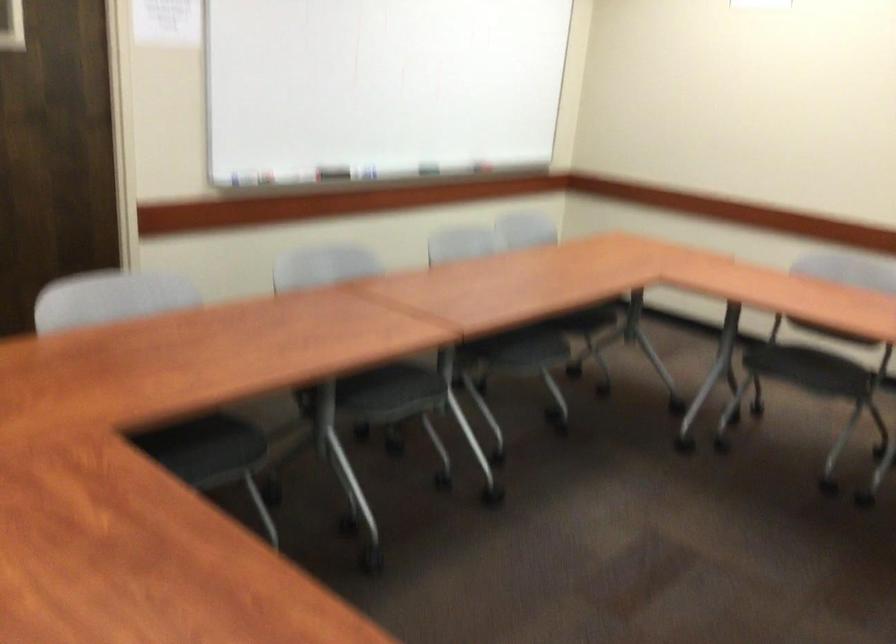
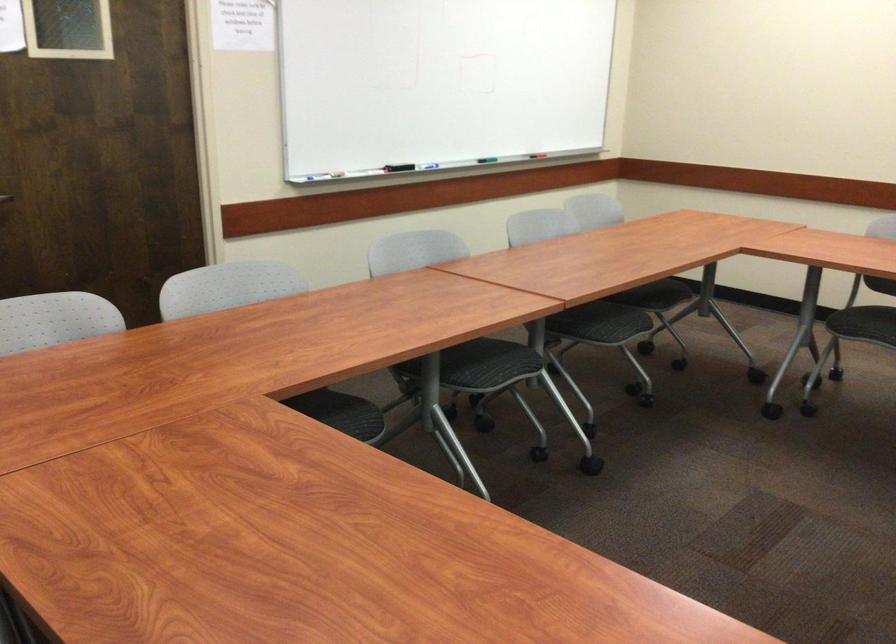
Where in the second image is the point corresponding to pixel 502 342 from the first image?

(583, 315)